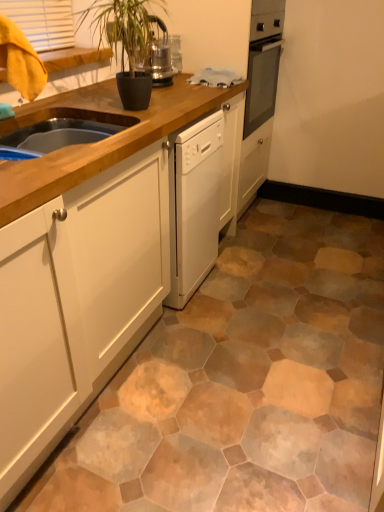
Question: From the image's perspective, relative to white matte cabinet at center, is dark green glossy plant at upper center above or below?

Choices:
 (A) above
 (B) below

Answer: (A)

Question: Considering the positions of dark green glossy plant at upper center and white matte cabinet at center in the image, is dark green glossy plant at upper center wider or thinner than white matte cabinet at center?

Choices:
 (A) wide
 (B) thin

Answer: (B)

Question: In terms of size, does dark green glossy plant at upper center appear bigger or smaller than white matte cabinet at center?

Choices:
 (A) small
 (B) big

Answer: (A)

Question: Is white matte cabinet at center situated inside dark green glossy plant at upper center or outside?

Choices:
 (A) inside
 (B) outside

Answer: (B)

Question: Considering their positions, is white matte cabinet at center located in front of or behind dark green glossy plant at upper center?

Choices:
 (A) behind
 (B) front

Answer: (B)

Question: Is white matte cabinet at center bigger or smaller than dark green glossy plant at upper center?

Choices:
 (A) big
 (B) small

Answer: (A)

Question: In the image, is white matte cabinet at center on the left side or the right side of dark green glossy plant at upper center?

Choices:
 (A) right
 (B) left

Answer: (B)